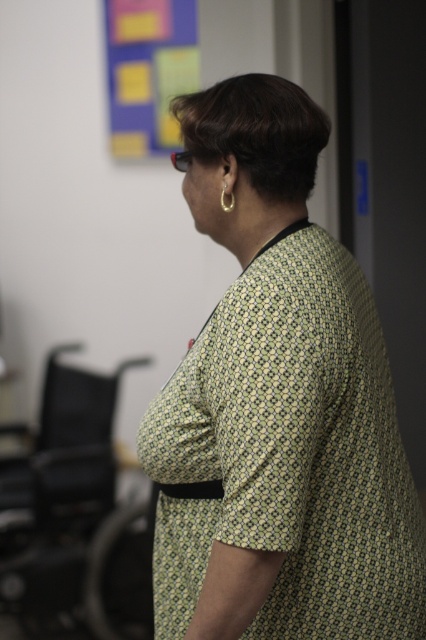
Between point (31, 552) and point (230, 189), which one is positioned in front?

Point (230, 189) is more forward.

Is black plastic swivel chair at left to the left of gold metallic hoop at upper right from the viewer's perspective?

Correct, you'll find black plastic swivel chair at left to the left of gold metallic hoop at upper right.

The height and width of the screenshot is (640, 426). Describe the element at coordinates (60, 492) in the screenshot. I see `black plastic swivel chair at left` at that location.

Where is `black plastic swivel chair at left`? Image resolution: width=426 pixels, height=640 pixels. black plastic swivel chair at left is located at coordinates (60, 492).

Where is `black plastic swivel chair at left`? The image size is (426, 640). black plastic swivel chair at left is located at coordinates (60, 492).

Does point (109, 456) come closer to viewer compared to point (181, 33)?

Yes, it is.

Where is `black plastic swivel chair at left`? black plastic swivel chair at left is located at coordinates (60, 492).

Which is more to the left, green printed dress at center or gold metallic hoop at upper right?

gold metallic hoop at upper right

Is green printed dress at center to the right of gold metallic hoop at upper right from the viewer's perspective?

Indeed, green printed dress at center is positioned on the right side of gold metallic hoop at upper right.

Image resolution: width=426 pixels, height=640 pixels. I want to click on green printed dress at center, so click(279, 406).